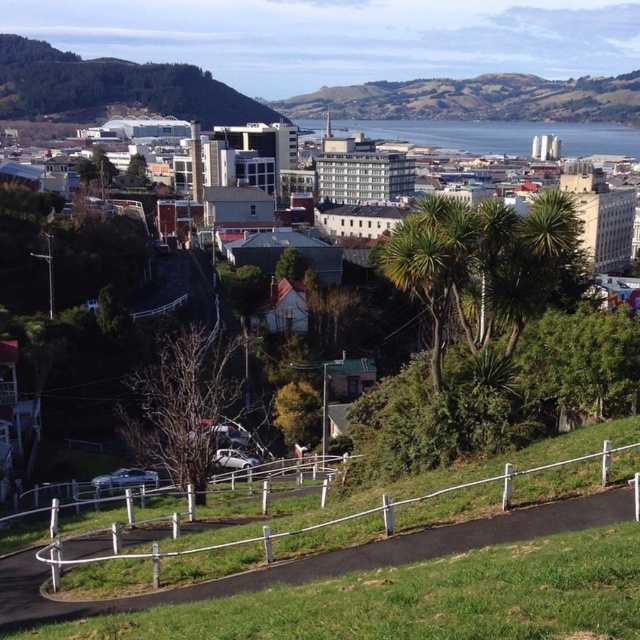
Question: Among these points, which one is nearest to the camera?

Choices:
 (A) (636, 154)
 (B) (204, 548)

Answer: (B)

Question: Which point is farther from the camera taking this photo?

Choices:
 (A) (512, 465)
 (B) (157, 67)
 (C) (618, 88)
 (D) (378, 570)

Answer: (C)

Question: Is green leafy hillside at upper left bigger than white metal fence at lower center?

Choices:
 (A) no
 (B) yes

Answer: (B)

Question: Is green grass at lower center bigger than white metal fence at lower center?

Choices:
 (A) no
 (B) yes

Answer: (A)

Question: Which point is farther from the camera taking this photo?

Choices:
 (A) (99, 86)
 (B) (572, 156)

Answer: (B)

Question: Can you confirm if green leafy hillside at upper left is positioned to the left of white plastic fence at center?

Choices:
 (A) no
 (B) yes

Answer: (B)